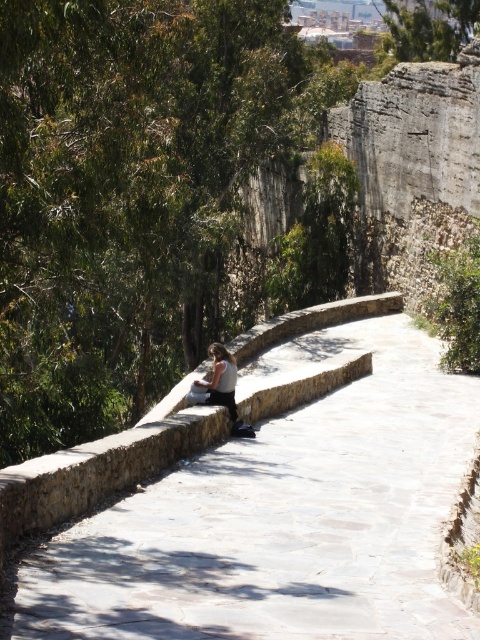
Question: Observing the image, what is the correct spatial positioning of stone paved path at center in reference to matte white shirt at center?

Choices:
 (A) left
 (B) right

Answer: (B)

Question: Can you confirm if green leafy tree at upper center is wider than matte white shirt at center?

Choices:
 (A) no
 (B) yes

Answer: (B)

Question: Can you confirm if stone paved path at center is smaller than matte white shirt at center?

Choices:
 (A) no
 (B) yes

Answer: (A)

Question: Which object appears farthest from the camera in this image?

Choices:
 (A) stone paved path at center
 (B) green leafy tree at upper center
 (C) matte white shirt at center

Answer: (B)

Question: Based on their relative distances, which object is farther from the stone paved path at center?

Choices:
 (A) green leafy tree at upper center
 (B) matte white shirt at center

Answer: (A)

Question: Considering the real-world distances, which object is closest to the green leafy tree at upper center?

Choices:
 (A) matte white shirt at center
 (B) stone paved path at center

Answer: (A)